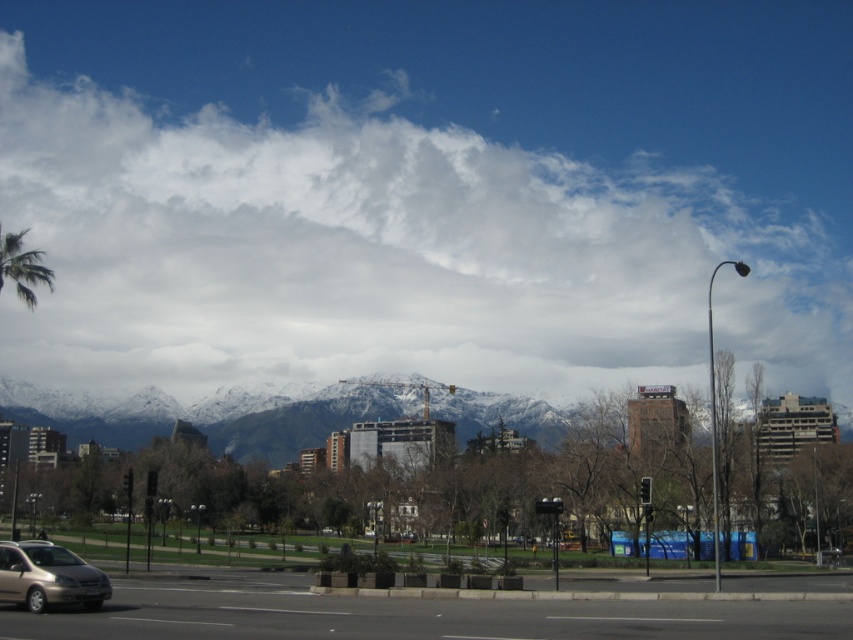
Where is `snowy mountain range at center`? The width and height of the screenshot is (853, 640). snowy mountain range at center is located at coordinates (209, 413).

Which of these two, snowy mountain range at center or green leafy palm tree at left, stands shorter?

Standing shorter between the two is green leafy palm tree at left.

Is point (515, 412) farther from camera compared to point (22, 300)?

Yes, point (515, 412) is behind point (22, 300).

Find the location of a particular element. The height and width of the screenshot is (640, 853). snowy mountain range at center is located at coordinates (209, 413).

Measure the distance from gold metallic van at lower left to green leafy palm tree at left.

gold metallic van at lower left is 31.62 meters away from green leafy palm tree at left.

Does point (68, 572) lie in front of point (13, 246)?

Yes, it is.

Locate an element on the screen. This screenshot has width=853, height=640. gold metallic van at lower left is located at coordinates (48, 577).

Is white fluffy cloud at upper center positioned behind snowy mountain range at center?

Yes, it is behind snowy mountain range at center.

Does point (674, 291) lie in front of point (305, 440)?

No, it is behind (305, 440).

The height and width of the screenshot is (640, 853). In order to click on white fluffy cloud at upper center in this screenshot , I will do `click(384, 252)`.